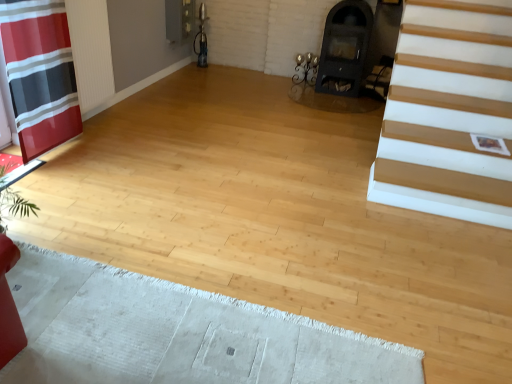
Question: Looking at the image, does red striped fabric at left seem bigger or smaller compared to black matte fireplace at upper center?

Choices:
 (A) small
 (B) big

Answer: (A)

Question: Is red striped fabric at left taller or shorter than black matte fireplace at upper center?

Choices:
 (A) short
 (B) tall

Answer: (B)

Question: Estimate the real-world distances between objects in this image. Which object is farther from the red striped fabric at left?

Choices:
 (A) matte black armchair at center
 (B) white textured rug at lower left
 (C) black matte fireplace at upper center

Answer: (A)

Question: Considering the real-world distances, which object is closest to the red striped fabric at left?

Choices:
 (A) white textured rug at lower left
 (B) black matte fireplace at upper center
 (C) matte black armchair at center

Answer: (A)